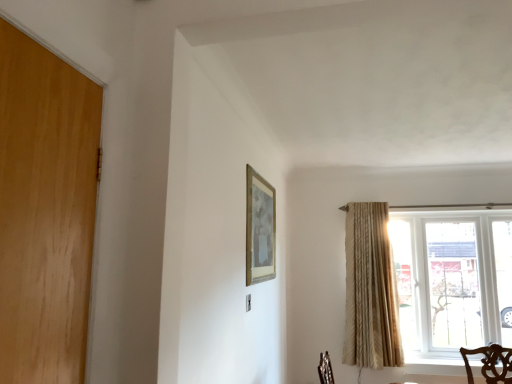
Question: From a real-world perspective, is gold metallic picture frame at upper center located higher than beige textured curtain at right?

Choices:
 (A) yes
 (B) no

Answer: (A)

Question: Is gold metallic picture frame at upper center at the right side of beige textured curtain at right?

Choices:
 (A) no
 (B) yes

Answer: (A)

Question: Considering the relative sizes of gold metallic picture frame at upper center and beige textured curtain at right in the image provided, is gold metallic picture frame at upper center shorter than beige textured curtain at right?

Choices:
 (A) yes
 (B) no

Answer: (A)

Question: Is gold metallic picture frame at upper center surrounding beige textured curtain at right?

Choices:
 (A) no
 (B) yes

Answer: (A)

Question: Does gold metallic picture frame at upper center have a larger size compared to beige textured curtain at right?

Choices:
 (A) no
 (B) yes

Answer: (A)

Question: From the image's perspective, relative to clear glass window at right, is beige textured curtain at right above or below?

Choices:
 (A) above
 (B) below

Answer: (A)

Question: In terms of height, does beige textured curtain at right look taller or shorter compared to clear glass window at right?

Choices:
 (A) tall
 (B) short

Answer: (A)

Question: Visually, is beige textured curtain at right positioned to the left or to the right of clear glass window at right?

Choices:
 (A) left
 (B) right

Answer: (A)

Question: From a real-world perspective, relative to clear glass window at right, is beige textured curtain at right vertically above or below?

Choices:
 (A) below
 (B) above

Answer: (B)

Question: Is beige textured curtain at right wider or thinner than gold metallic picture frame at upper center?

Choices:
 (A) thin
 (B) wide

Answer: (B)

Question: Do you think beige textured curtain at right is within gold metallic picture frame at upper center, or outside of it?

Choices:
 (A) inside
 (B) outside

Answer: (B)

Question: From a real-world perspective, is beige textured curtain at right physically located above or below gold metallic picture frame at upper center?

Choices:
 (A) below
 (B) above

Answer: (A)

Question: Considering the positions of beige textured curtain at right and gold metallic picture frame at upper center in the image, is beige textured curtain at right taller or shorter than gold metallic picture frame at upper center?

Choices:
 (A) tall
 (B) short

Answer: (A)

Question: In terms of size, does gold metallic picture frame at upper center appear bigger or smaller than clear glass window at right?

Choices:
 (A) small
 (B) big

Answer: (A)

Question: Is gold metallic picture frame at upper center inside or outside of clear glass window at right?

Choices:
 (A) outside
 (B) inside

Answer: (A)